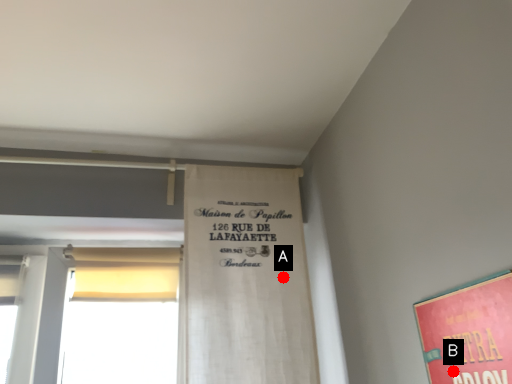
Question: Two points are circled on the image, labeled by A and B beside each circle. Among these points, which one is nearest to the camera?

Choices:
 (A) A is closer
 (B) B is closer

Answer: (B)